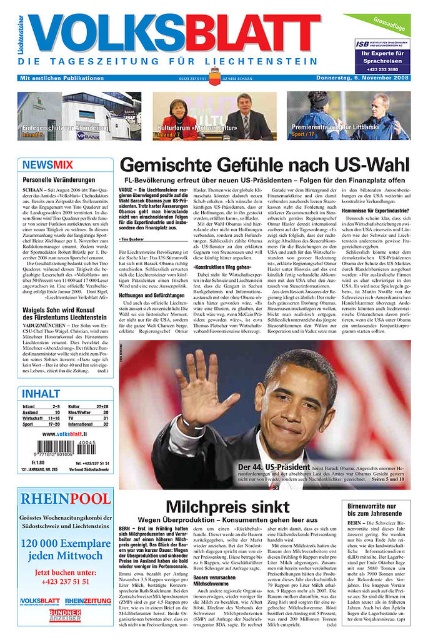
Question: Can you confirm if dark gray suit at center is positioned above matte black suit at center?

Choices:
 (A) no
 (B) yes

Answer: (A)

Question: Which point is closer to the camera?

Choices:
 (A) dark gray suit at center
 (B) matte black suit at center

Answer: (A)

Question: Can you confirm if dark gray suit at center is bigger than matte black suit at center?

Choices:
 (A) no
 (B) yes

Answer: (B)

Question: Among these points, which one is farthest from the camera?

Choices:
 (A) (249, 125)
 (B) (284, 449)

Answer: (A)

Question: Can you confirm if dark gray suit at center is positioned above matte black suit at center?

Choices:
 (A) yes
 (B) no

Answer: (B)